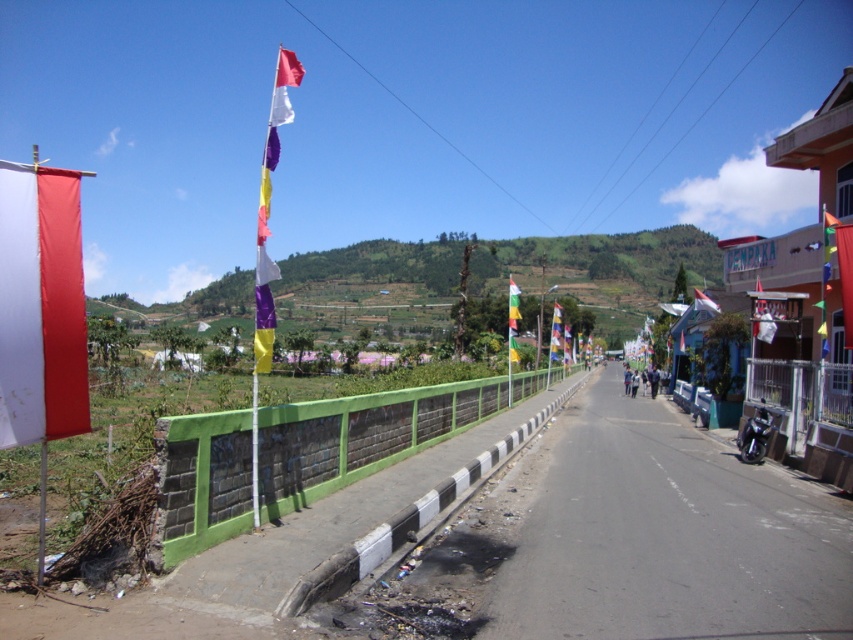
Does green painted brick wall at center come behind yellow-green fabric flag at center?

No, it is not.

Can you confirm if green painted brick wall at center is positioned to the left of yellow-green fabric flag at center?

Indeed, green painted brick wall at center is positioned on the left side of yellow-green fabric flag at center.

In order to click on green painted brick wall at center in this screenshot , I will do `click(360, 436)`.

The width and height of the screenshot is (853, 640). I want to click on green painted brick wall at center, so click(x=360, y=436).

Can you confirm if matte fabric flag at center is positioned to the right of multicolored fabric flag at center?

Incorrect, matte fabric flag at center is not on the right side of multicolored fabric flag at center.

Which of these two, matte fabric flag at center or multicolored fabric flag at center, stands shorter?

multicolored fabric flag at center is shorter.

Which is behind, point (257, 307) or point (561, 324)?

The point (561, 324) is more distant.

In order to click on matte fabric flag at center in this screenshot , I will do `click(268, 208)`.

Does multicolored fabric flag at center have a lesser width compared to white fabric flag at center?

Indeed, multicolored fabric flag at center has a lesser width compared to white fabric flag at center.

Does multicolored fabric flag at center have a lesser height compared to white fabric flag at center?

In fact, multicolored fabric flag at center may be taller than white fabric flag at center.

Does point (556, 337) come in front of point (699, 294)?

No, it is not.

Locate an element on the screen. multicolored fabric flag at center is located at coordinates tap(555, 333).